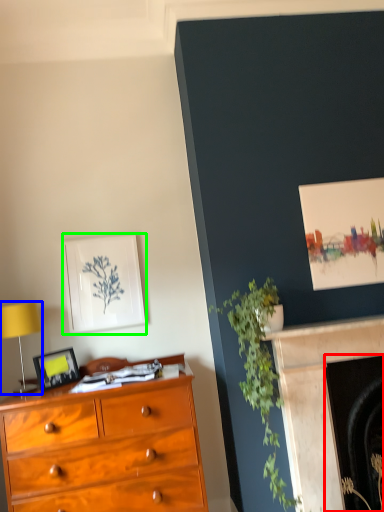
Question: Which object is the closest to the fireplace (highlighted by a red box)? Choose among these: table lamp (highlighted by a blue box) or picture frame (highlighted by a green box).

Choices:
 (A) table lamp
 (B) picture frame

Answer: (B)